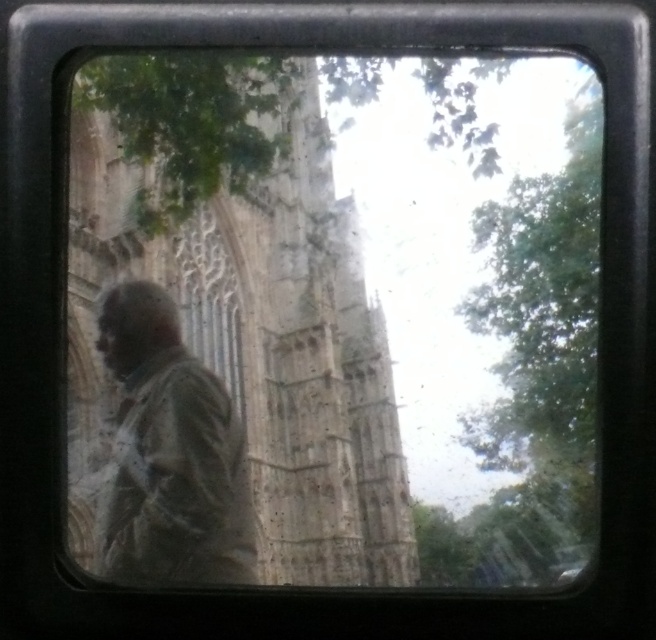
You are standing in front of the historic stone building in the image. You notice the transparent glass window at center and the distressed brown jacket at left. Which object is closer to you according to the scene?

The transparent glass window at center is closer to you because it is in front of the distressed brown jacket at left.

You are an architect analyzing the proportions of the building in the image. Based on the transparent glass window at center and the distressed brown jacket at left, which object appears larger in height?

The transparent glass window at center appears much taller than the distressed brown jacket at left.

You are an art conservator examining the image through a vintage camera frame. You notice the transparent glass window at center and the distressed brown jacket at left. Based on their positions, which object is closer to the camera lens?

The distressed brown jacket at left is closer to the camera lens because it is positioned below the transparent glass window at center, which is placed above it. In a typical perspective, objects lower in the frame are closer to the viewer.